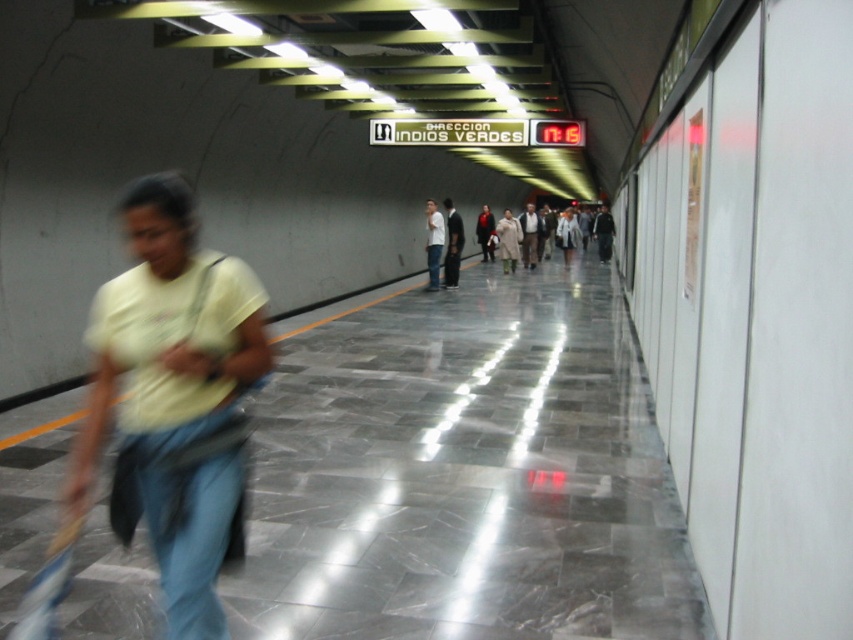
Can you confirm if blue denim jeans at left is bigger than white shirt at center?

Incorrect, blue denim jeans at left is not larger than white shirt at center.

In the scene shown: Does blue denim jeans at left appear on the left side of white shirt at center?

Correct, you'll find blue denim jeans at left to the left of white shirt at center.

Image resolution: width=853 pixels, height=640 pixels. What do you see at coordinates (186, 512) in the screenshot? I see `blue denim jeans at left` at bounding box center [186, 512].

The height and width of the screenshot is (640, 853). What are the coordinates of `blue denim jeans at left` in the screenshot? It's located at (186, 512).

Looking at this image, between white shirt at center and dark gray jacket at center, which one is positioned lower?

white shirt at center

Does white shirt at center appear on the right side of dark gray jacket at center?

No, white shirt at center is not to the right of dark gray jacket at center.

The height and width of the screenshot is (640, 853). In order to click on white shirt at center in this screenshot , I will do `click(451, 244)`.

Who is lower down, light beige coat at center or dark gray jacket at center?

light beige coat at center

Is light beige coat at center closer to the viewer compared to dark gray jacket at center?

That is True.

What do you see at coordinates (508, 241) in the screenshot? The height and width of the screenshot is (640, 853). I see `light beige coat at center` at bounding box center [508, 241].

Identify the location of light beige coat at center. This screenshot has width=853, height=640. (508, 241).